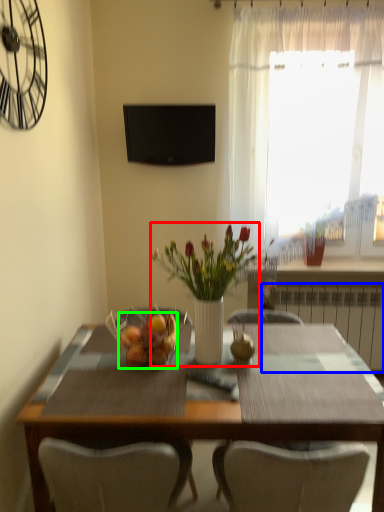
Question: Which object is the closest to the floral arrangement (highlighted by a red box)? Choose among these: radiator (highlighted by a blue box) or fruit dish (highlighted by a green box).

Choices:
 (A) radiator
 (B) fruit dish

Answer: (B)